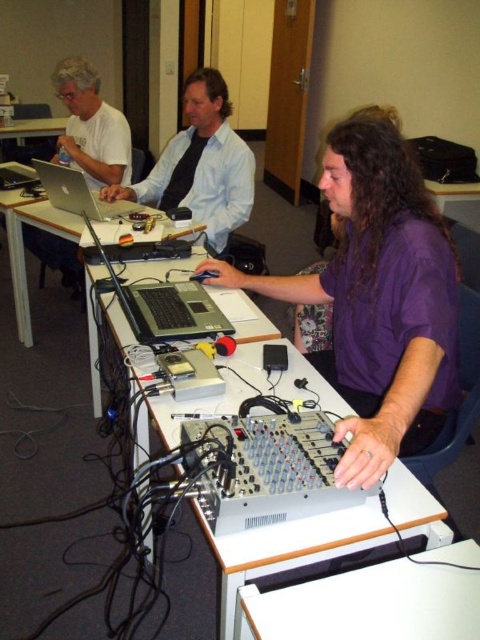
You are a technician in the room and need to access the silver metallic laptop at left. However, the white matte shirt at upper left is blocking it. Can you move the shirt to access the laptop?

The white matte shirt at upper left is positioned over the silver metallic laptop at left, so moving the shirt would allow access to the laptop.

You are organizing a small event and need to place a 1.2 meter long tablecloth on the white plastic table at lower center. Based on the coordinates provided in the scene description, can the tablecloth fit properly without hanging off the edges?

The white plastic table at lower center is located at point coordinates, but the description does not provide the table dimensions. Therefore, it is impossible to determine if the 1.2 meter long tablecloth will fit without additional information about the table size.

You are standing in the room and see two points marked on the desk. The first point is at position (130, 136) and the second point is at (40, 170). Which point is closer to you?

Point (130, 136) is further to the viewer than point (40, 170). Therefore, the second point at (40, 170) is closer to you.